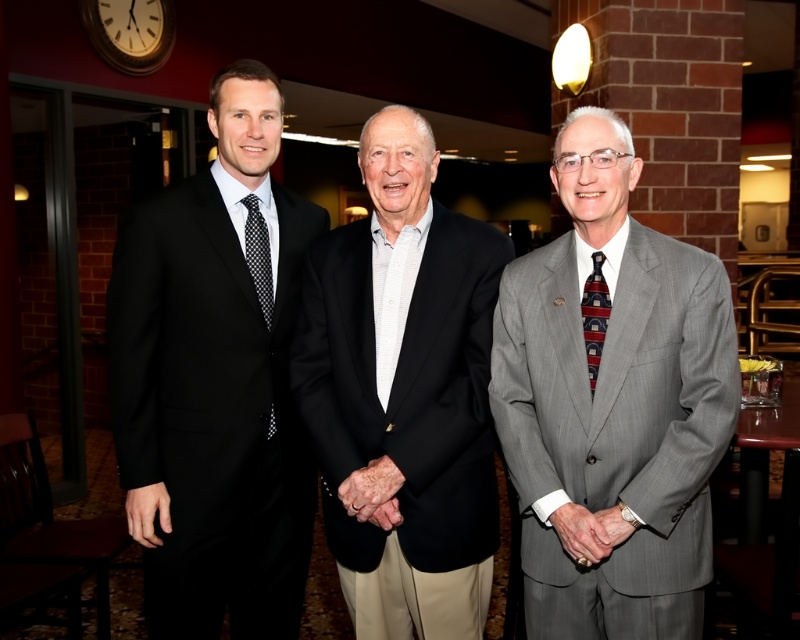
You are at a formal event and need to locate the man wearing the smooth gray suit at center. Based on the coordinates provided in the scene description, where exactly would you find him relative to the other attendees?

The smooth gray suit at center is located at point coordinates (588,531), which places him centrally among the three men standing side by side in the image.

You are a photographer setting up a camera to capture the scene. You notice the smooth skin hand at center and the smooth gray suit at center. Which object should you focus on first if you want to ensure both are in sharp focus, considering their sizes?

The smooth skin hand at center might be wider than smooth gray suit at center, so focusing on the wider object first would help ensure both are in sharp focus.

You are a photographer at the event and need to capture a photo of both the smooth skin hand at center and the smooth gray suit at center. Which object should be placed to the left in the frame?

The smooth skin hand at center should be placed to the left of the smooth gray suit at center because it is positioned on the left side of it.